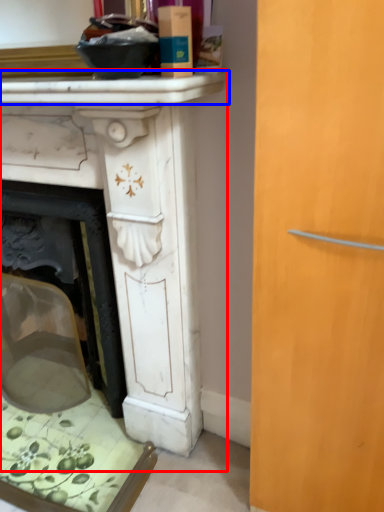
Question: Which object appears closest to the camera in this image, table (highlighted by a red box) or counter top (highlighted by a blue box)?

Choices:
 (A) table
 (B) counter top

Answer: (B)